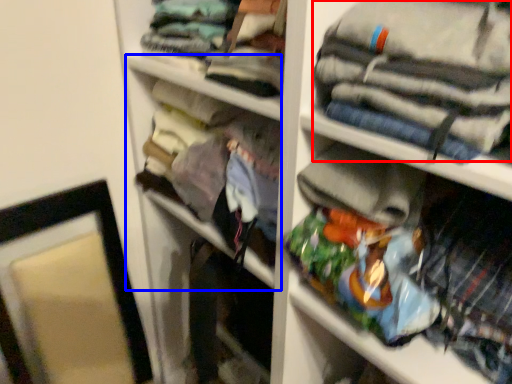
Question: Among these objects, which one is nearest to the camera, clothing (highlighted by a red box) or cabinet (highlighted by a blue box)?

Choices:
 (A) clothing
 (B) cabinet

Answer: (A)